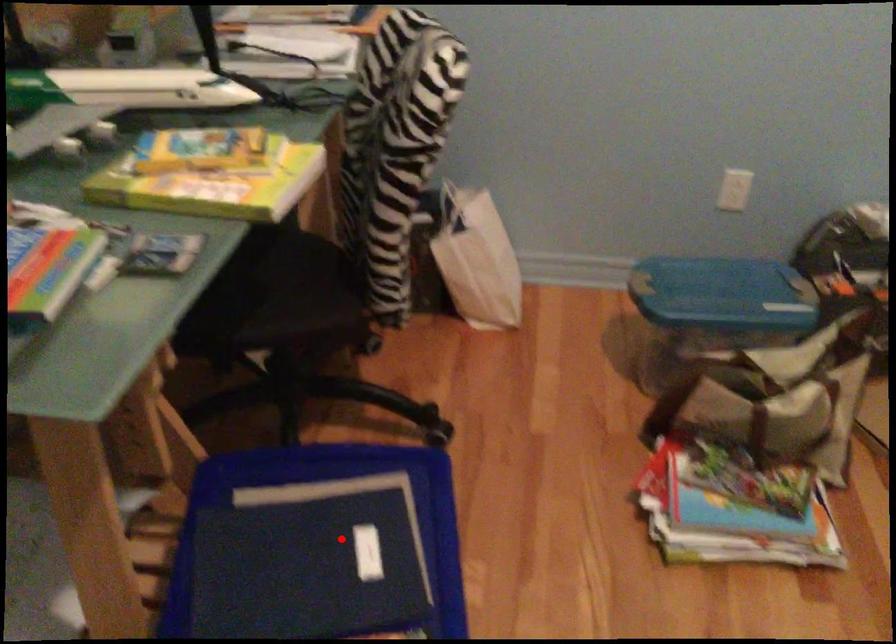
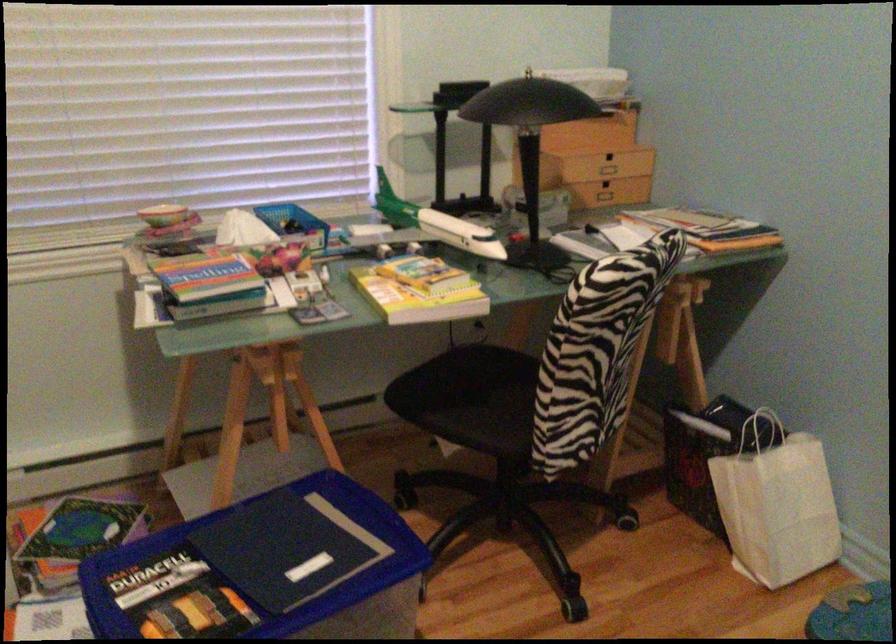
Where in the second image is the point corresponding to the highlighted location from the first image?

(316, 551)